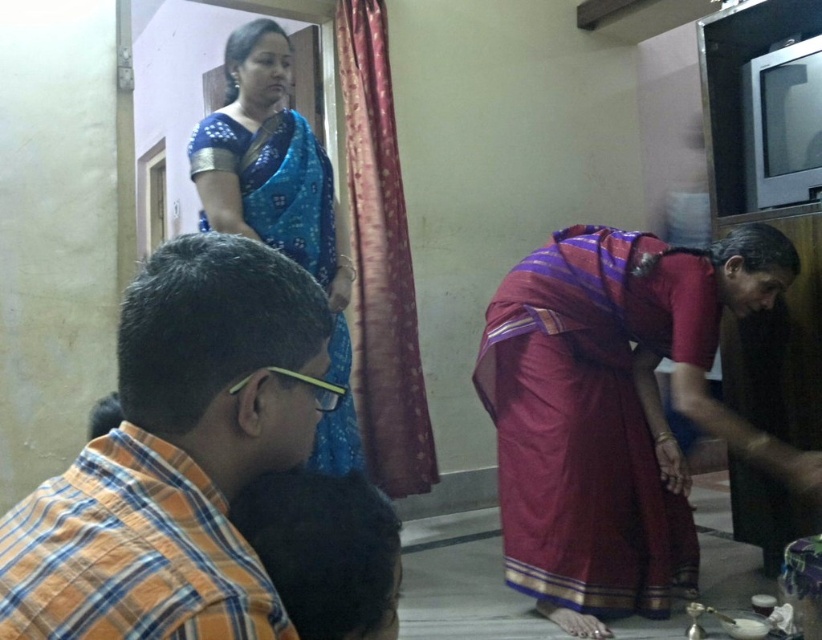
You are standing in the room and want to reach a specific point marked at coordinates point (45, 508). If your arm can extend 24 inches, can you comfortably reach that point without moving closer?

The distance of point (45, 508) from the camera is 25.46 inches. Since your arm can only extend 24 inches, you cannot comfortably reach that point without moving closer.

Based on the scene description, can you determine the spatial relationship between the orange plaid shirt at lower left and the maroon silk saree at lower center?

The orange plaid shirt at lower left is above the maroon silk saree at lower center according to the description.

You are a photographer trying to capture the scene from the back of the room. Which object, the orange plaid shirt at lower left or the blue silk saree at upper left, will appear closer to the camera in your photo?

The orange plaid shirt at lower left is in front of the blue silk saree at upper left, so it will appear closer to the camera in the photo.